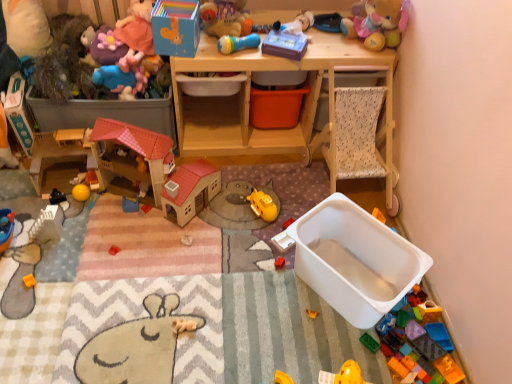
This screenshot has height=384, width=512. Find the location of `free space between yellow rubber ball at center-left, the second toy positioned from the left, and blue plastic toy at center, the 5th toy viewed from the left`. free space between yellow rubber ball at center-left, the second toy positioned from the left, and blue plastic toy at center, the 5th toy viewed from the left is located at coordinates (105, 204).